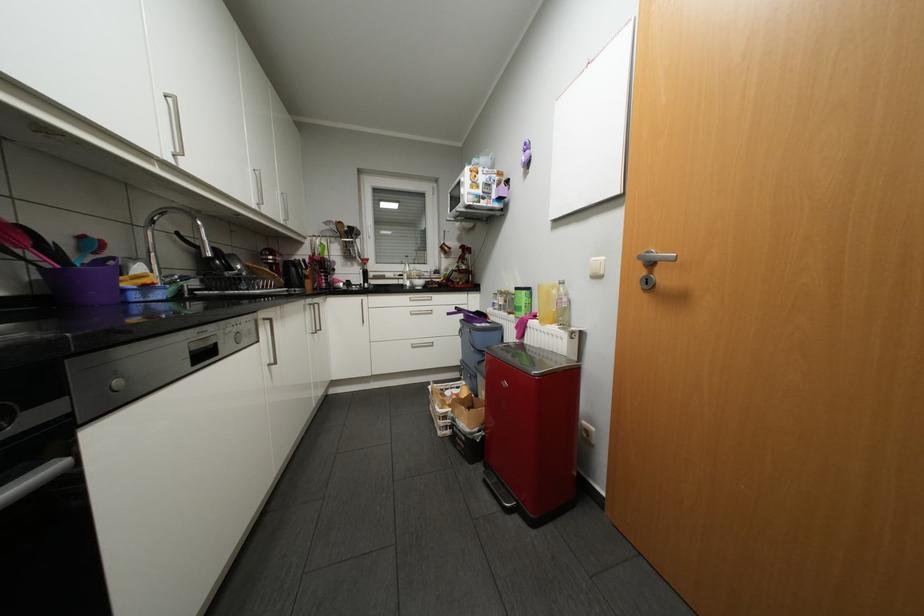
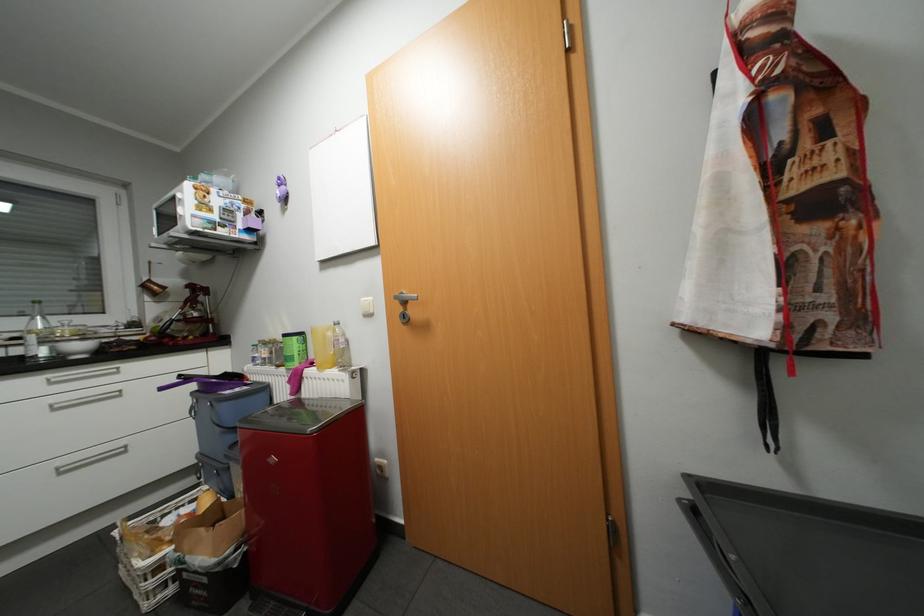
Find the pixel in the second image that matches point 419,300 in the first image.

(61, 382)